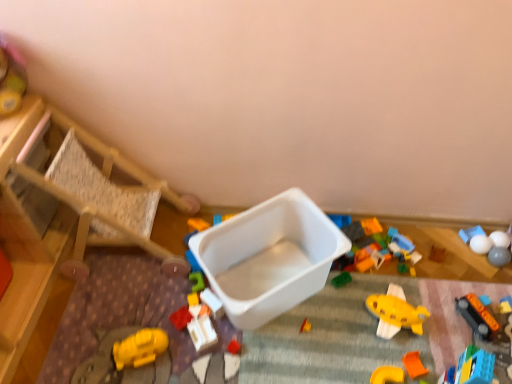
Identify the location of free spot to the left of smooth gray ball at lower right, the thirteenth toy when ordered from left to right. (447, 265).